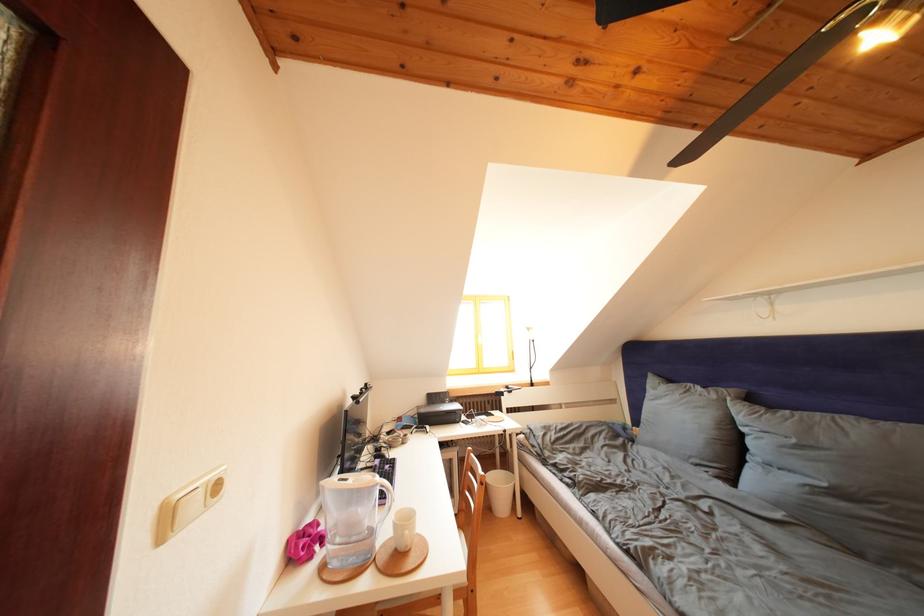
Where is `water pitcher handle`? water pitcher handle is located at coordinates (383, 496).